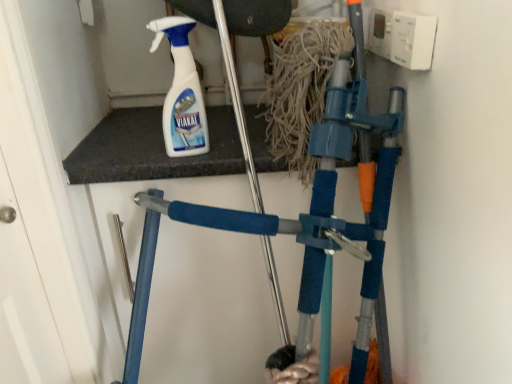
Looking at this image, measure the distance between white plastic spray bottle at upper center and camera.

A distance of 78.96 centimeters exists between white plastic spray bottle at upper center and camera.

Locate an element on the screen. The width and height of the screenshot is (512, 384). white plastic spray bottle at upper center is located at coordinates (181, 91).

Describe the element at coordinates (181, 91) in the screenshot. This screenshot has width=512, height=384. I see `white plastic spray bottle at upper center` at that location.

This screenshot has width=512, height=384. Describe the element at coordinates (302, 216) in the screenshot. I see `blue foam crutch at center` at that location.

Measure the distance between blue foam crutch at center and camera.

The distance of blue foam crutch at center from camera is 25.46 inches.

The height and width of the screenshot is (384, 512). Find the location of `blue foam crutch at center`. blue foam crutch at center is located at coordinates (302, 216).

Where is `white plastic spray bottle at upper center`? white plastic spray bottle at upper center is located at coordinates (181, 91).

Considering the positions of objects blue foam crutch at center and white plastic spray bottle at upper center in the image provided, who is more to the left, blue foam crutch at center or white plastic spray bottle at upper center?

white plastic spray bottle at upper center is more to the left.

Which is behind, blue foam crutch at center or white plastic spray bottle at upper center?

blue foam crutch at center is further away from the camera.

Considering the points (232, 226) and (185, 107), which point is behind, point (232, 226) or point (185, 107)?

Point (185, 107)

From the image's perspective, is blue foam crutch at center above or below white plastic spray bottle at upper center?

From the image's perspective, blue foam crutch at center appears below white plastic spray bottle at upper center.

From a real-world perspective, is blue foam crutch at center above or below white plastic spray bottle at upper center?

From a real-world perspective, blue foam crutch at center is physically below white plastic spray bottle at upper center.

Is blue foam crutch at center wider or thinner than white plastic spray bottle at upper center?

Considering their sizes, blue foam crutch at center looks broader than white plastic spray bottle at upper center.

Considering the relative sizes of blue foam crutch at center and white plastic spray bottle at upper center in the image provided, is blue foam crutch at center shorter than white plastic spray bottle at upper center?

No, blue foam crutch at center is not shorter than white plastic spray bottle at upper center.

Is blue foam crutch at center bigger or smaller than white plastic spray bottle at upper center?

Considering their sizes, blue foam crutch at center takes up more space than white plastic spray bottle at upper center.

Is blue foam crutch at center inside or outside of white plastic spray bottle at upper center?

blue foam crutch at center cannot be found inside white plastic spray bottle at upper center.

Is blue foam crutch at center with white plastic spray bottle at upper center?

No, blue foam crutch at center is not touching white plastic spray bottle at upper center.

Is white plastic spray bottle at upper center at the back of blue foam crutch at center?

blue foam crutch at center does not have its back to white plastic spray bottle at upper center.

How many degrees apart are the facing directions of blue foam crutch at center and white plastic spray bottle at upper center?

blue foam crutch at center and white plastic spray bottle at upper center are facing 13.9 degrees away from each other.

At what (x,y) coordinates should I click in order to perform the action: click on crutch behind the white plastic spray bottle at upper center. Please return your answer as a coordinate pair (x, y). This screenshot has width=512, height=384. Looking at the image, I should click on (302, 216).

Considering the positions of objects white plastic spray bottle at upper center and blue foam crutch at center in the image provided, who is more to the left, white plastic spray bottle at upper center or blue foam crutch at center?

From the viewer's perspective, white plastic spray bottle at upper center appears more on the left side.

Which object is further away from the camera, white plastic spray bottle at upper center or blue foam crutch at center?

blue foam crutch at center is behind.

Is point (190, 121) closer to viewer compared to point (285, 230)?

No, (190, 121) is further to viewer.

From the picture: From the image's perspective, which one is positioned higher, white plastic spray bottle at upper center or blue foam crutch at center?

white plastic spray bottle at upper center, from the image's perspective.

Based on the photo, from a real-world perspective, is white plastic spray bottle at upper center beneath blue foam crutch at center?

No, from a real-world perspective, white plastic spray bottle at upper center is not under blue foam crutch at center.

Is white plastic spray bottle at upper center wider or thinner than blue foam crutch at center?

white plastic spray bottle at upper center is thinner than blue foam crutch at center.

Considering the sizes of objects white plastic spray bottle at upper center and blue foam crutch at center in the image provided, who is shorter, white plastic spray bottle at upper center or blue foam crutch at center?

Standing shorter between the two is white plastic spray bottle at upper center.

Considering the sizes of objects white plastic spray bottle at upper center and blue foam crutch at center in the image provided, who is smaller, white plastic spray bottle at upper center or blue foam crutch at center?

white plastic spray bottle at upper center is smaller.

Is blue foam crutch at center inside white plastic spray bottle at upper center?

No, white plastic spray bottle at upper center does not contain blue foam crutch at center.

Is white plastic spray bottle at upper center positioned far away from blue foam crutch at center?

No, white plastic spray bottle at upper center is not far from blue foam crutch at center.

Is white plastic spray bottle at upper center facing towards blue foam crutch at center?

No, white plastic spray bottle at upper center is not facing towards blue foam crutch at center.

This screenshot has height=384, width=512. I want to click on crutch located on the right of white plastic spray bottle at upper center, so click(x=302, y=216).

The width and height of the screenshot is (512, 384). Identify the location of cleaning product that appears above the blue foam crutch at center (from a real-world perspective). (181, 91).

Image resolution: width=512 pixels, height=384 pixels. Find the location of `cleaning product in front of the blue foam crutch at center`. cleaning product in front of the blue foam crutch at center is located at coordinates (181, 91).